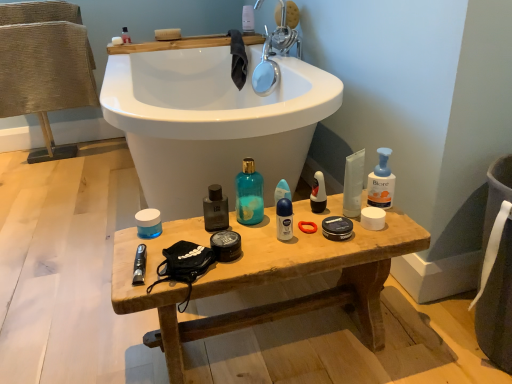
You are a GUI agent. You are given a task and a screenshot of the screen. Output one action in this format:
    pyautogui.click(x=<x>, y=<y>)
    Task: Click on the vacant area that is in front of translucent plastic jar at center, the 1th toiletry in the bottom-to-top sequence
    The image size is (512, 384).
    Given the screenshot: What is the action you would take?
    pyautogui.click(x=148, y=257)